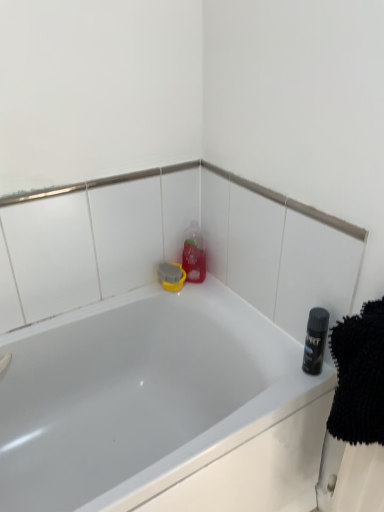
At what (x,y) coordinates should I click in order to perform the action: click on vacant space that is to the left of shiny black can at right. Please return your answer as a coordinate pair (x, y). This screenshot has width=384, height=512. Looking at the image, I should click on (273, 375).